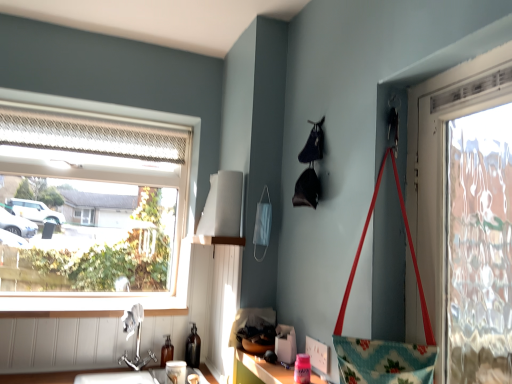
Question: Is clear glass window at upper left facing towards white plastic power outlet at lower center?

Choices:
 (A) yes
 (B) no

Answer: (A)

Question: Does clear glass window at upper left have a lesser width compared to white plastic power outlet at lower center?

Choices:
 (A) yes
 (B) no

Answer: (B)

Question: Is clear glass window at upper left positioned in front of white plastic power outlet at lower center?

Choices:
 (A) yes
 (B) no

Answer: (B)

Question: Considering the relative sizes of clear glass window at upper left and white plastic power outlet at lower center in the image provided, is clear glass window at upper left smaller than white plastic power outlet at lower center?

Choices:
 (A) no
 (B) yes

Answer: (A)

Question: Is clear glass window at upper left turned away from white plastic power outlet at lower center?

Choices:
 (A) no
 (B) yes

Answer: (A)

Question: Considering the relative sizes of clear glass window at upper left and white plastic power outlet at lower center in the image provided, is clear glass window at upper left wider than white plastic power outlet at lower center?

Choices:
 (A) no
 (B) yes

Answer: (B)

Question: Can you confirm if translucent glass bottle at lower center, the 1th bottle in the left-to-right sequence, is positioned to the left of pink plastic container at lower center?

Choices:
 (A) no
 (B) yes

Answer: (B)

Question: Are translucent glass bottle at lower center, the 1th bottle in the left-to-right sequence, and pink plastic container at lower center beside each other?

Choices:
 (A) yes
 (B) no

Answer: (B)

Question: Does translucent glass bottle at lower center, placed as the second bottle when sorted from right to left, come in front of pink plastic container at lower center?

Choices:
 (A) no
 (B) yes

Answer: (A)

Question: Is translucent glass bottle at lower center, placed as the second bottle when sorted from right to left, further to camera compared to pink plastic container at lower center?

Choices:
 (A) no
 (B) yes

Answer: (B)

Question: From the image's perspective, does translucent glass bottle at lower center, the 1th bottle in the left-to-right sequence, appear higher than pink plastic container at lower center?

Choices:
 (A) yes
 (B) no

Answer: (B)

Question: Is translucent glass bottle at lower center, the 1th bottle in the left-to-right sequence, shorter than pink plastic container at lower center?

Choices:
 (A) yes
 (B) no

Answer: (B)

Question: Does silver metallic faucet at lower left have a greater height compared to matte white cup at lower center?

Choices:
 (A) no
 (B) yes

Answer: (B)